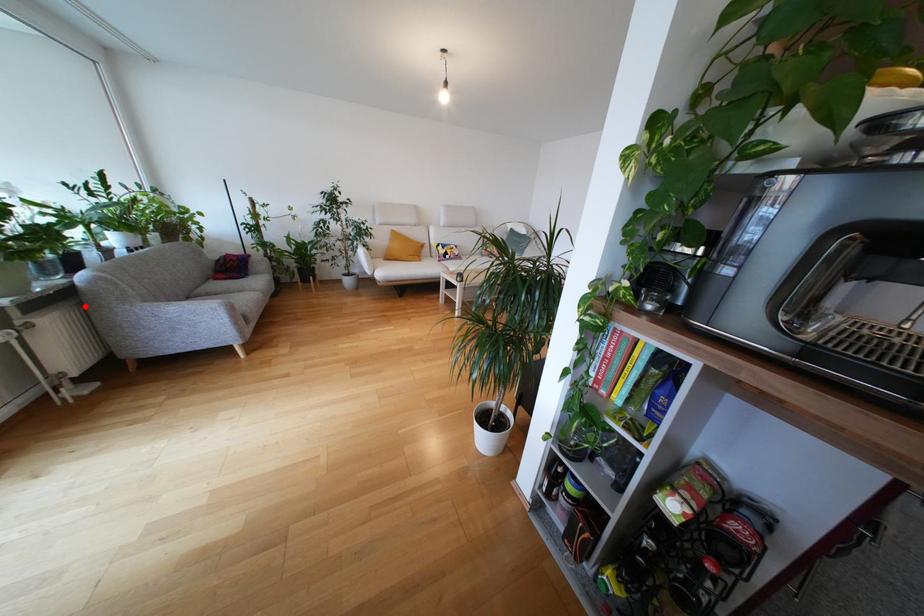
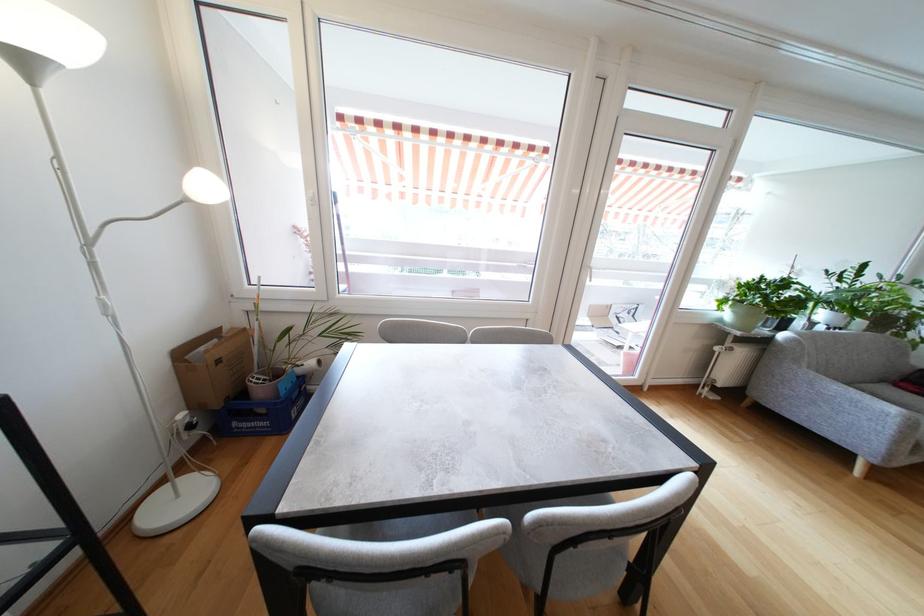
Where in the second image is the point corresponding to the highlighted location from the first image?

(768, 352)